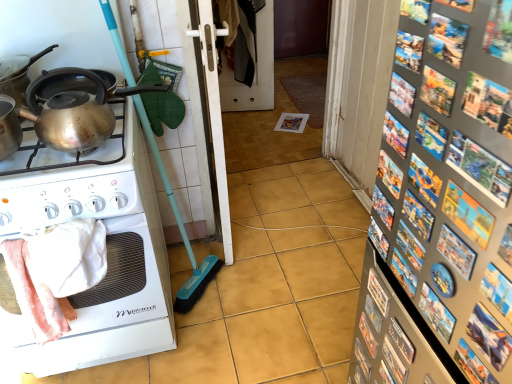
Question: Does shiny metallic kettle at upper left have a lesser width compared to white glossy stove at left?

Choices:
 (A) yes
 (B) no

Answer: (A)

Question: Considering the relative positions of shiny metallic kettle at upper left and white glossy stove at left in the image provided, is shiny metallic kettle at upper left to the right of white glossy stove at left from the viewer's perspective?

Choices:
 (A) yes
 (B) no

Answer: (A)

Question: Does shiny metallic kettle at upper left have a greater height compared to white glossy stove at left?

Choices:
 (A) no
 (B) yes

Answer: (A)

Question: From a real-world perspective, does shiny metallic kettle at upper left stand above white glossy stove at left?

Choices:
 (A) yes
 (B) no

Answer: (A)

Question: Is shiny metallic kettle at upper left to the left of white glossy stove at left from the viewer's perspective?

Choices:
 (A) yes
 (B) no

Answer: (B)

Question: Is white plastic screen door at center, placed as the 1th screen door when sorted from front to back, to the left or to the right of metallic silver magnets at right in the image?

Choices:
 (A) right
 (B) left

Answer: (B)

Question: Relative to metallic silver magnets at right, is white plastic screen door at center, placed as the 1th screen door when sorted from front to back, in front or behind?

Choices:
 (A) behind
 (B) front

Answer: (A)

Question: Considering the positions of white plastic screen door at center, placed as the 1th screen door when sorted from front to back, and metallic silver magnets at right in the image, is white plastic screen door at center, placed as the 1th screen door when sorted from front to back, taller or shorter than metallic silver magnets at right?

Choices:
 (A) short
 (B) tall

Answer: (A)

Question: From the image's perspective, is white plastic screen door at center, placed as the 1th screen door when sorted from front to back, positioned above or below metallic silver magnets at right?

Choices:
 (A) below
 (B) above

Answer: (B)

Question: In terms of width, does shiny metallic kettle at upper left look wider or thinner when compared to white glossy stove at left?

Choices:
 (A) wide
 (B) thin

Answer: (B)

Question: Considering the relative positions of shiny metallic kettle at upper left and white glossy stove at left in the image provided, is shiny metallic kettle at upper left to the left or to the right of white glossy stove at left?

Choices:
 (A) left
 (B) right

Answer: (B)

Question: Is point (65, 127) positioned closer to the camera than point (74, 177)?

Choices:
 (A) closer
 (B) farther

Answer: (A)

Question: From the image's perspective, is shiny metallic kettle at upper left located above or below white glossy stove at left?

Choices:
 (A) above
 (B) below

Answer: (A)

Question: From a real-world perspective, is shiny metallic kettle at upper left above or below white glossy stove at left?

Choices:
 (A) below
 (B) above

Answer: (B)

Question: Considering the positions of shiny metallic kettle at upper left and white glossy stove at left in the image, is shiny metallic kettle at upper left bigger or smaller than white glossy stove at left?

Choices:
 (A) big
 (B) small

Answer: (B)